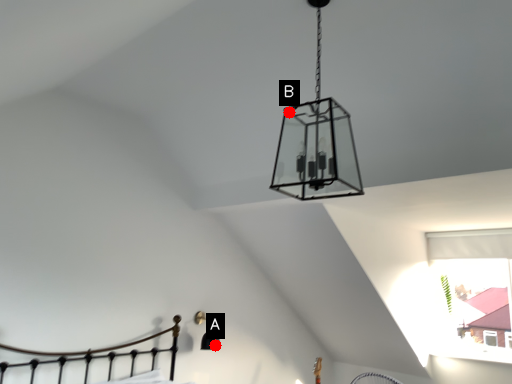
Question: Two points are circled on the image, labeled by A and B beside each circle. Which point is farther from the camera taking this photo?

Choices:
 (A) A is further
 (B) B is further

Answer: (A)